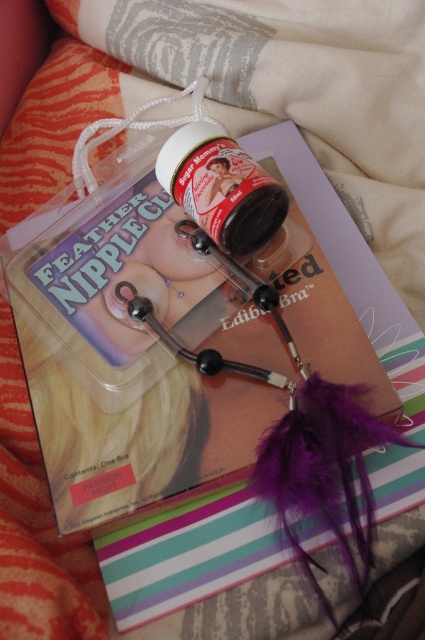
You are organizing a gift basket and need to place both the purple feathered magazine at center and the white matte jar at center into a small box. The box can only hold items that are no taller than 10 cm. Which item should you place first to ensure both fit?

The purple feathered magazine at center is larger in size than the white matte jar at center, so you should place the larger magazine first to make space for the smaller jar.